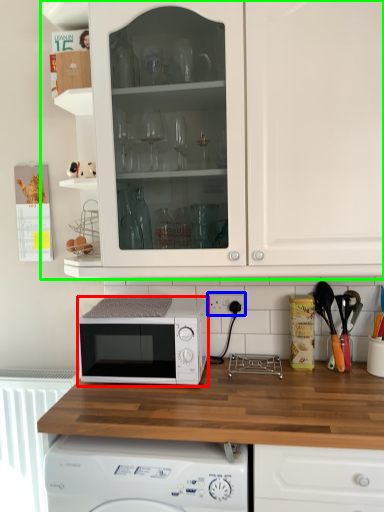
Question: Which object is the closest to the microwave oven (highlighted by a red box)? Choose among these: electric outlet (highlighted by a blue box) or cabinetry (highlighted by a green box).

Choices:
 (A) electric outlet
 (B) cabinetry

Answer: (A)